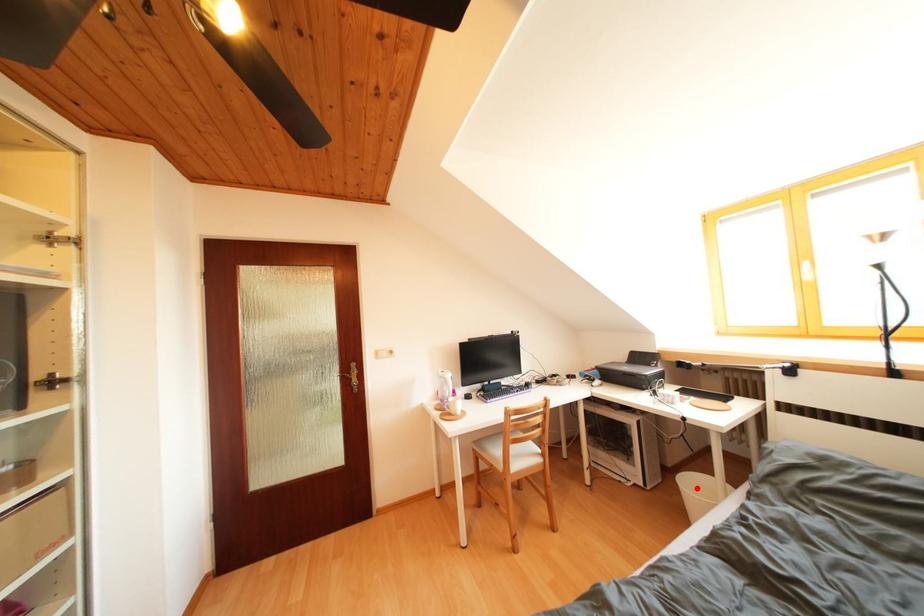
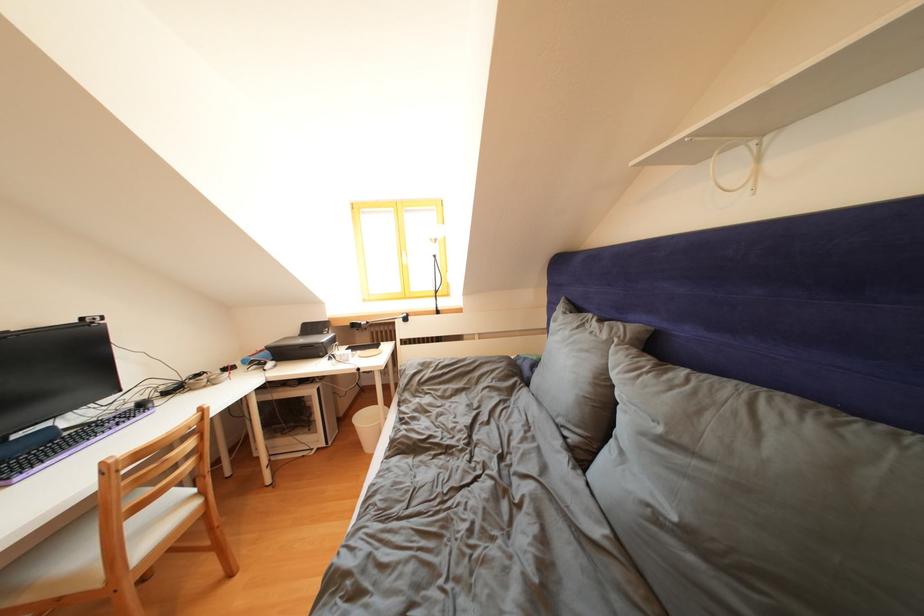
The point at the highlighted location is marked in the first image. Where is the corresponding point in the second image?

(371, 424)